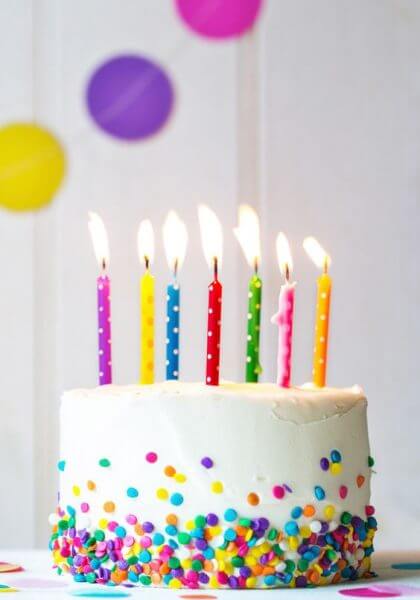
At what (x,y) coordinates should I click in order to perform the action: click on birthday candles. Please return your answer as a coordinate pair (x, y). The width and height of the screenshot is (420, 600). Looking at the image, I should click on (101, 319), (146, 322), (172, 328), (214, 333), (253, 335), (285, 340), (323, 339).